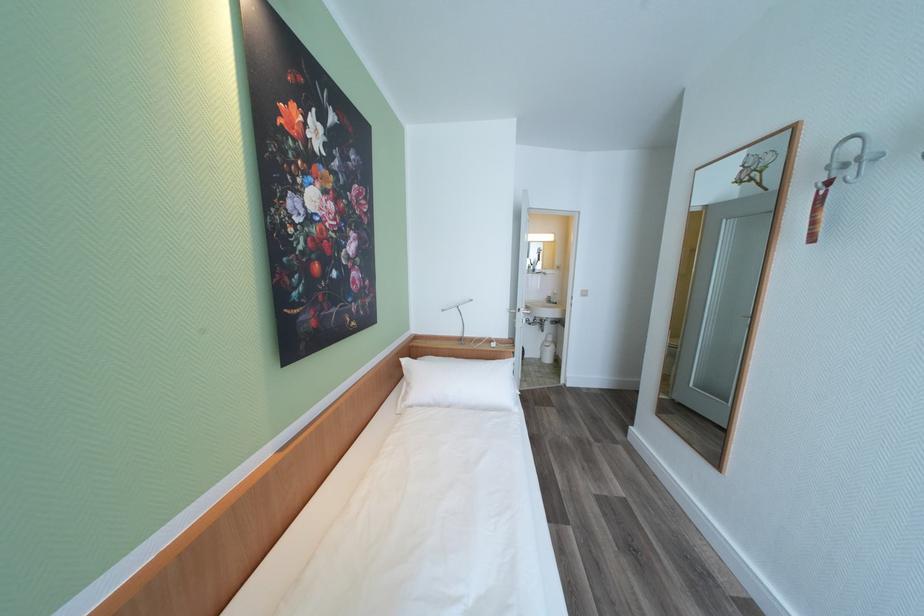
Locate an element on the screen. This screenshot has height=616, width=924. white light switch is located at coordinates (584, 292).